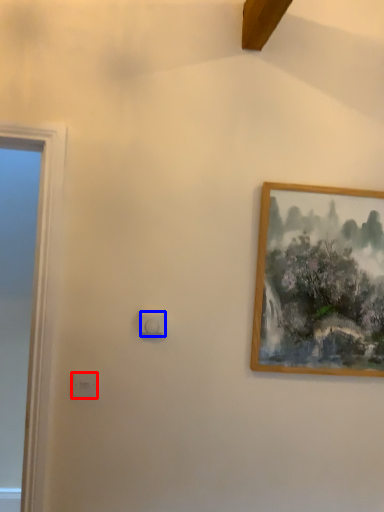
Question: Which of the following is the closest to the observer, light switch (highlighted by a red box) or light switch (highlighted by a blue box)?

Choices:
 (A) light switch
 (B) light switch

Answer: (A)